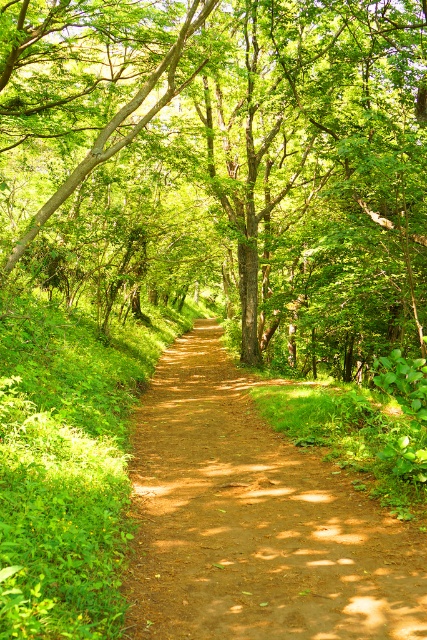
Question: Among these objects, which one is farthest from the camera?

Choices:
 (A) dirt path at center
 (B) green leafy tree at center

Answer: (B)

Question: Does green leafy tree at center appear under dirt path at center?

Choices:
 (A) yes
 (B) no

Answer: (B)

Question: Does green leafy tree at center have a greater width compared to dirt path at center?

Choices:
 (A) no
 (B) yes

Answer: (B)

Question: Is the position of green leafy tree at center less distant than that of dirt path at center?

Choices:
 (A) yes
 (B) no

Answer: (B)